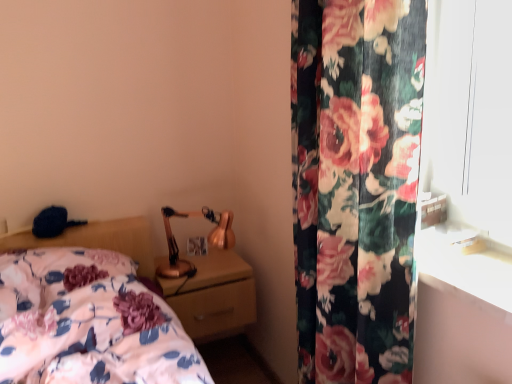
The image size is (512, 384). Find the location of `vacant space in copper metallic table lamp at upper right (from a real-world perspective)`. vacant space in copper metallic table lamp at upper right (from a real-world perspective) is located at coordinates (197, 272).